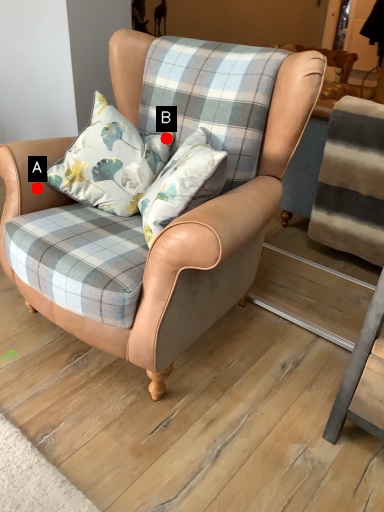
Question: Two points are circled on the image, labeled by A and B beside each circle. Which of the following is the closest to the observer?

Choices:
 (A) A is closer
 (B) B is closer

Answer: (A)